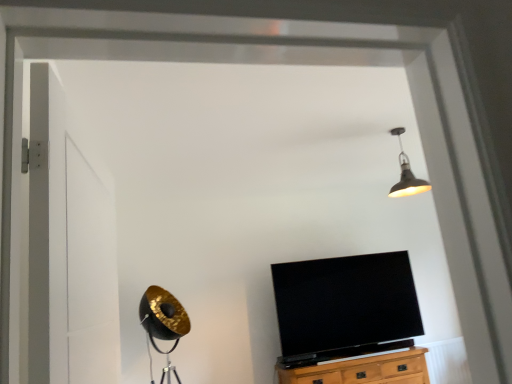
This screenshot has height=384, width=512. Describe the element at coordinates (406, 174) in the screenshot. I see `metallic pendant light at upper center` at that location.

Locate an element on the screen. The height and width of the screenshot is (384, 512). wooden cabinet at lower center is located at coordinates (362, 369).

Consider the image. From a real-world perspective, relative to wooden cabinet at lower center, is white matte door at left vertically above or below?

white matte door at left is situated higher than wooden cabinet at lower center in the real world.

Looking at this image, would you say white matte door at left is a long distance from wooden cabinet at lower center?

Yes.

Could you tell me if white matte door at left is turned towards wooden cabinet at lower center?

No, white matte door at left is not aimed at wooden cabinet at lower center.

Who is taller, white matte door at left or wooden cabinet at lower center?

white matte door at left.

Does point (30, 67) lie in front of point (389, 340)?

Yes, it is in front of point (389, 340).

Is white matte door at left not near black glossy tv at center?

That's right, there is a large distance between white matte door at left and black glossy tv at center.

From the image's perspective, which is below, white matte door at left or black glossy tv at center?

black glossy tv at center appears lower in the image.

Between white matte door at left and metallic pendant light at upper center, which one has more height?

white matte door at left is taller.

From the image's perspective, is white matte door at left located beneath metallic pendant light at upper center?

Yes, from the image's perspective, white matte door at left is below metallic pendant light at upper center.

Are white matte door at left and metallic pendant light at upper center far apart?

white matte door at left is far away from metallic pendant light at upper center.

Looking at this image, from a real-world perspective, who is located higher, white matte door at left or metallic pendant light at upper center?

metallic pendant light at upper center is physically above.

From a real-world perspective, between black glossy tv at center and metallic pendant light at upper center, who is vertically higher?

From a 3D spatial view, metallic pendant light at upper center is above.

Can you confirm if black glossy tv at center is smaller than metallic pendant light at upper center?

Actually, black glossy tv at center might be larger than metallic pendant light at upper center.

Is black glossy tv at center in front of or behind metallic pendant light at upper center in the image?

black glossy tv at center is behind metallic pendant light at upper center.

Image resolution: width=512 pixels, height=384 pixels. What are the coordinates of `light fixture on the right side of black glossy tv at center` in the screenshot? It's located at [x=406, y=174].

Considering the relative positions of wooden cabinet at lower center and white matte door at left in the image provided, is wooden cabinet at lower center to the right of white matte door at left from the viewer's perspective?

Correct, you'll find wooden cabinet at lower center to the right of white matte door at left.

Is wooden cabinet at lower center oriented towards white matte door at left?

No, wooden cabinet at lower center is not facing towards white matte door at left.

Does point (340, 379) appear closer or farther from the camera than point (48, 174)?

Point (340, 379) is farther from the camera than point (48, 174).

Considering the relative sizes of wooden cabinet at lower center and white matte door at left in the image provided, is wooden cabinet at lower center smaller than white matte door at left?

No.

Which is further, (399, 182) or (340, 370)?

Point (340, 370)

What's the angular difference between metallic pendant light at upper center and wooden cabinet at lower center's facing directions?

The angular difference between metallic pendant light at upper center and wooden cabinet at lower center is 1.59 degrees.

How far apart are metallic pendant light at upper center and wooden cabinet at lower center?

metallic pendant light at upper center and wooden cabinet at lower center are 5.63 feet apart from each other.

From a real-world perspective, is metallic pendant light at upper center positioned above or below wooden cabinet at lower center?

From a real-world perspective, metallic pendant light at upper center is physically above wooden cabinet at lower center.

From the image's perspective, between metallic pendant light at upper center and black glossy tv at center, which one is located above?

metallic pendant light at upper center, from the image's perspective.

Could you tell me if metallic pendant light at upper center is facing black glossy tv at center?

No, metallic pendant light at upper center is not aimed at black glossy tv at center.

Does metallic pendant light at upper center have a greater height compared to black glossy tv at center?

No, metallic pendant light at upper center is not taller than black glossy tv at center.

From a real-world perspective, is metallic pendant light at upper center physically located above or below black glossy tv at center?

In terms of real-world spatial position, metallic pendant light at upper center is above black glossy tv at center.

Identify the location of door in front of the wooden cabinet at lower center. Image resolution: width=512 pixels, height=384 pixels. (68, 250).

Identify the location of television beneath the white matte door at left (from a real-world perspective). The height and width of the screenshot is (384, 512). (345, 307).

When comparing their distances from black glossy tv at center, does wooden cabinet at lower center or metallic pendant light at upper center seem further?

Among the two, metallic pendant light at upper center is located further to black glossy tv at center.

Looking at the image, which one is located closer to black glossy tv at center, metallic pendant light at upper center or wooden cabinet at lower center?

Based on the image, wooden cabinet at lower center appears to be nearer to black glossy tv at center.

Considering their positions, is wooden cabinet at lower center positioned further to metallic pendant light at upper center than black glossy tv at center?

wooden cabinet at lower center is positioned further to the anchor metallic pendant light at upper center.

When comparing their distances from white matte door at left, does metallic pendant light at upper center or black glossy tv at center seem further?

black glossy tv at center is positioned further to the anchor white matte door at left.

Estimate the real-world distances between objects in this image. Which object is further from wooden cabinet at lower center, metallic pendant light at upper center or black glossy tv at center?

Among the two, metallic pendant light at upper center is located further to wooden cabinet at lower center.

Estimate the real-world distances between objects in this image. Which object is further from black glossy tv at center, white matte door at left or wooden cabinet at lower center?

white matte door at left is further to black glossy tv at center.

Based on their spatial positions, is white matte door at left or black glossy tv at center closer to metallic pendant light at upper center?

black glossy tv at center is positioned closer to the anchor metallic pendant light at upper center.

From the image, which object appears to be nearer to metallic pendant light at upper center, white matte door at left or wooden cabinet at lower center?

Among the two, wooden cabinet at lower center is located nearer to metallic pendant light at upper center.

Where is `light fixture between white matte door at left and wooden cabinet at lower center along the z-axis`? light fixture between white matte door at left and wooden cabinet at lower center along the z-axis is located at coordinates coord(406,174).

Find the location of a particular element. light fixture between white matte door at left and black glossy tv at center in the front-back direction is located at coordinates (406, 174).

At what (x,y) coordinates should I click in order to perform the action: click on cabinetry located between white matte door at left and black glossy tv at center in the depth direction. Please return your answer as a coordinate pair (x, y). The height and width of the screenshot is (384, 512). Looking at the image, I should click on (362, 369).

Find the location of `television between metallic pendant light at upper center and wooden cabinet at lower center from top to bottom`. television between metallic pendant light at upper center and wooden cabinet at lower center from top to bottom is located at coordinates click(x=345, y=307).